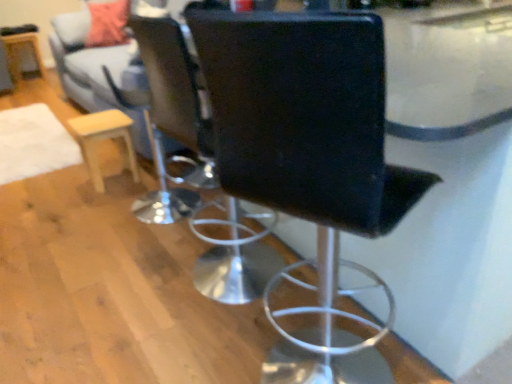
Question: Is black leather chair at center, arranged as the first chair when viewed from the back, to the right of black leather chair at center, the 2th chair when ordered from back to front, from the viewer's perspective?

Choices:
 (A) yes
 (B) no

Answer: (B)

Question: Considering the relative sizes of black leather chair at center, the 2th chair positioned from the front, and black leather chair at center, the 1th chair in the front-to-back sequence, in the image provided, is black leather chair at center, the 2th chair positioned from the front, thinner than black leather chair at center, the 1th chair in the front-to-back sequence,?

Choices:
 (A) yes
 (B) no

Answer: (A)

Question: Is black leather chair at center, arranged as the first chair when viewed from the back, smaller than black leather chair at center, the 1th chair in the front-to-back sequence?

Choices:
 (A) yes
 (B) no

Answer: (A)

Question: Is black leather chair at center, arranged as the first chair when viewed from the back, positioned beyond the bounds of black leather chair at center, the 2th chair when ordered from back to front?

Choices:
 (A) yes
 (B) no

Answer: (A)

Question: Does black leather chair at center, arranged as the first chair when viewed from the back, have a greater width compared to black leather chair at center, the 2th chair when ordered from back to front?

Choices:
 (A) no
 (B) yes

Answer: (A)

Question: From a real-world perspective, is black leather chair at center, arranged as the first chair when viewed from the back, physically located above or below light gray fabric couch at upper left?

Choices:
 (A) below
 (B) above

Answer: (B)

Question: In the image, is black leather chair at center, the 2th chair positioned from the front, positioned in front of or behind light gray fabric couch at upper left?

Choices:
 (A) behind
 (B) front

Answer: (B)

Question: In terms of width, does black leather chair at center, arranged as the first chair when viewed from the back, look wider or thinner when compared to light gray fabric couch at upper left?

Choices:
 (A) wide
 (B) thin

Answer: (B)

Question: Would you say black leather chair at center, arranged as the first chair when viewed from the back, is inside or outside light gray fabric couch at upper left?

Choices:
 (A) outside
 (B) inside

Answer: (A)

Question: Considering the positions of black leather chair at center, arranged as the first chair when viewed from the back, and wooden round table at left in the image, is black leather chair at center, arranged as the first chair when viewed from the back, wider or thinner than wooden round table at left?

Choices:
 (A) thin
 (B) wide

Answer: (A)

Question: Is black leather chair at center, the 2th chair positioned from the front, spatially inside wooden round table at left, or outside of it?

Choices:
 (A) outside
 (B) inside

Answer: (A)

Question: Is black leather chair at center, arranged as the first chair when viewed from the back, in front of or behind wooden round table at left in the image?

Choices:
 (A) front
 (B) behind

Answer: (A)

Question: In terms of height, does black leather chair at center, arranged as the first chair when viewed from the back, look taller or shorter compared to wooden round table at left?

Choices:
 (A) tall
 (B) short

Answer: (A)

Question: Is light wood/finely finished stool at left in front of or behind black leather chair at center, the 2th chair positioned from the front, in the image?

Choices:
 (A) behind
 (B) front

Answer: (A)

Question: Considering the positions of point (84, 117) and point (168, 99), is point (84, 117) closer or farther from the camera than point (168, 99)?

Choices:
 (A) farther
 (B) closer

Answer: (A)